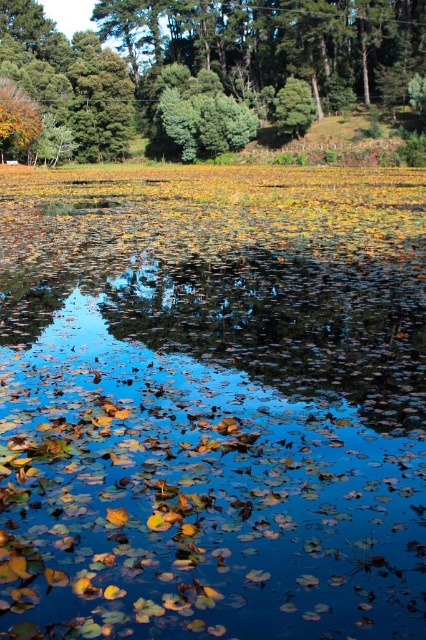
You are standing at point (212, 403) in the serene natural scene. What do you see directly in front of you?

You see yellow green leaves at center directly in front of you at point (212, 403).